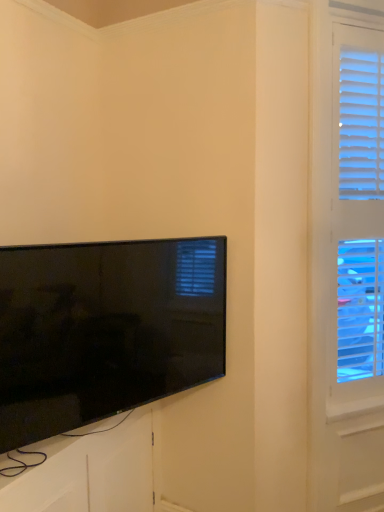
The width and height of the screenshot is (384, 512). Describe the element at coordinates (356, 223) in the screenshot. I see `white textured blinds at right` at that location.

Locate an element on the screen. The image size is (384, 512). white textured blinds at right is located at coordinates (356, 223).

The image size is (384, 512). Describe the element at coordinates (105, 330) in the screenshot. I see `flat-screen tv at lower left` at that location.

Identify the location of flat-screen tv at lower left. (105, 330).

This screenshot has width=384, height=512. Identify the location of white textured blinds at right. (356, 223).

Would you say flat-screen tv at lower left is to the left or to the right of white textured blinds at right in the picture?

flat-screen tv at lower left is to the left of white textured blinds at right.

Considering the positions of objects flat-screen tv at lower left and white textured blinds at right in the image provided, who is behind, flat-screen tv at lower left or white textured blinds at right?

white textured blinds at right is behind.

Between point (179, 285) and point (351, 335), which one is positioned in front?

Point (179, 285)

From the image's perspective, who appears lower, flat-screen tv at lower left or white textured blinds at right?

From the image's view, flat-screen tv at lower left is below.

From a real-world perspective, is flat-screen tv at lower left below white textured blinds at right?

Yes.

Is flat-screen tv at lower left thinner than white textured blinds at right?

Yes.

Who is shorter, flat-screen tv at lower left or white textured blinds at right?

With less height is flat-screen tv at lower left.

Between flat-screen tv at lower left and white textured blinds at right, which one has larger size?

white textured blinds at right.

Is flat-screen tv at lower left not within white textured blinds at right?

Yes, flat-screen tv at lower left is located beyond the bounds of white textured blinds at right.

Are flat-screen tv at lower left and white textured blinds at right making contact?

No, flat-screen tv at lower left is not with white textured blinds at right.

In the scene shown: Is flat-screen tv at lower left oriented towards white textured blinds at right?

No, flat-screen tv at lower left is not facing towards white textured blinds at right.

Measure the distance from flat-screen tv at lower left to white textured blinds at right.

They are 96.61 centimeters apart.

Identify the location of window above the flat-screen tv at lower left (from the image's perspective). (356, 223).

Considering the positions of objects white textured blinds at right and flat-screen tv at lower left in the image provided, who is more to the left, white textured blinds at right or flat-screen tv at lower left?

flat-screen tv at lower left is more to the left.

Is the depth of white textured blinds at right greater than that of flat-screen tv at lower left?

Yes.

Which point is more distant from viewer, (381, 84) or (138, 362)?

The point (381, 84) is farther from the camera.

From the image's perspective, is white textured blinds at right located above or below flat-screen tv at lower left?

white textured blinds at right is situated higher than flat-screen tv at lower left in the image.

From a real-world perspective, is white textured blinds at right physically above flat-screen tv at lower left?

Yes.

Can you confirm if white textured blinds at right is thinner than flat-screen tv at lower left?

Incorrect, the width of white textured blinds at right is not less than that of flat-screen tv at lower left.

Considering the sizes of objects white textured blinds at right and flat-screen tv at lower left in the image provided, who is taller, white textured blinds at right or flat-screen tv at lower left?

white textured blinds at right is taller.

Does white textured blinds at right have a smaller size compared to flat-screen tv at lower left?

Actually, white textured blinds at right might be larger than flat-screen tv at lower left.

Is white textured blinds at right positioned beyond the bounds of flat-screen tv at lower left?

Yes.

Is white textured blinds at right with flat-screen tv at lower left?

white textured blinds at right and flat-screen tv at lower left are clearly separated.

Could you tell me if white textured blinds at right is facing flat-screen tv at lower left?

No, white textured blinds at right is not turned towards flat-screen tv at lower left.

Identify the location of window lying above the flat-screen tv at lower left (from the image's perspective). Image resolution: width=384 pixels, height=512 pixels. (356, 223).

What are the coordinates of `television on the left side of white textured blinds at right` in the screenshot? It's located at (105, 330).

At what (x,y) coordinates should I click in order to perform the action: click on television in front of the white textured blinds at right. Please return your answer as a coordinate pair (x, y). Looking at the image, I should click on (105, 330).